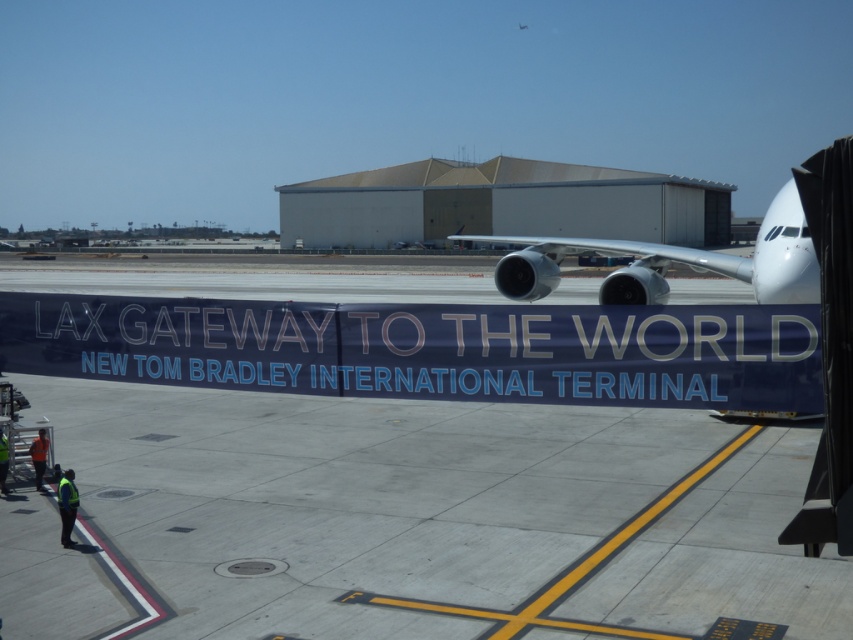
Question: Which point appears closest to the camera in this image?

Choices:
 (A) (669, 179)
 (B) (521, 296)

Answer: (B)

Question: Which is nearer to the white corrugated metal hangar at center?

Choices:
 (A) silver metallic airplane at right
 (B) gray concrete tarmac at center

Answer: (A)

Question: Does gray concrete tarmac at center have a smaller size compared to silver metallic airplane at right?

Choices:
 (A) no
 (B) yes

Answer: (B)

Question: Among these objects, which one is farthest from the camera?

Choices:
 (A) gray concrete tarmac at center
 (B) silver metallic airplane at right
 (C) white corrugated metal hangar at center

Answer: (C)

Question: Can you confirm if gray concrete tarmac at center is positioned to the left of white corrugated metal hangar at center?

Choices:
 (A) no
 (B) yes

Answer: (B)

Question: Does gray concrete tarmac at center come in front of white corrugated metal hangar at center?

Choices:
 (A) no
 (B) yes

Answer: (B)